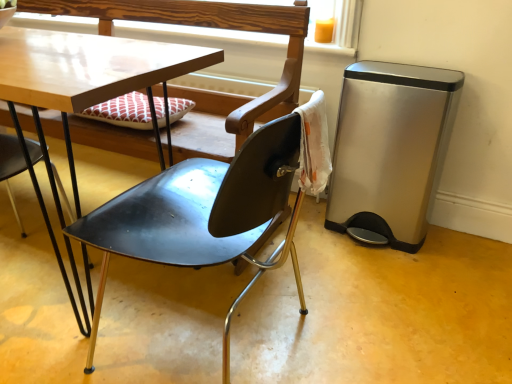
Question: Is the surface of black metal chair at lower left, the second chair when ordered from right to left, in direct contact with matte black chair at center, arranged as the first chair when viewed from the right?

Choices:
 (A) no
 (B) yes

Answer: (A)

Question: Does black metal chair at lower left, which appears as the 1th chair when viewed from the left, turn towards matte black chair at center, which is counted as the 2th chair, starting from the left?

Choices:
 (A) yes
 (B) no

Answer: (A)

Question: Is black metal chair at lower left, which appears as the 1th chair when viewed from the left, to the left of matte black chair at center, arranged as the first chair when viewed from the right, from the viewer's perspective?

Choices:
 (A) yes
 (B) no

Answer: (A)

Question: From the image's perspective, is black metal chair at lower left, the second chair when ordered from right to left, beneath matte black chair at center, which is counted as the 2th chair, starting from the left?

Choices:
 (A) no
 (B) yes

Answer: (B)

Question: Are black metal chair at lower left, the second chair when ordered from right to left, and matte black chair at center, arranged as the first chair when viewed from the right, far apart?

Choices:
 (A) yes
 (B) no

Answer: (B)

Question: Is black metal chair at lower left, the second chair when ordered from right to left, thinner than matte black chair at center, which is counted as the 2th chair, starting from the left?

Choices:
 (A) yes
 (B) no

Answer: (A)

Question: Can you confirm if satin silver trash can at right is positioned to the right of black metal chair at lower left, which appears as the 1th chair when viewed from the left?

Choices:
 (A) yes
 (B) no

Answer: (A)

Question: Is satin silver trash can at right beside black metal chair at lower left, the second chair when ordered from right to left?

Choices:
 (A) no
 (B) yes

Answer: (A)

Question: From the image's perspective, is satin silver trash can at right on black metal chair at lower left, the second chair when ordered from right to left?

Choices:
 (A) yes
 (B) no

Answer: (A)

Question: Is satin silver trash can at right wider than black metal chair at lower left, the second chair when ordered from right to left?

Choices:
 (A) yes
 (B) no

Answer: (B)

Question: Is satin silver trash can at right not close to black metal chair at lower left, the second chair when ordered from right to left?

Choices:
 (A) no
 (B) yes

Answer: (B)

Question: From the image's perspective, is satin silver trash can at right located beneath black metal chair at lower left, the second chair when ordered from right to left?

Choices:
 (A) yes
 (B) no

Answer: (B)

Question: Is wooden at upper center facing towards matte black chair at center, which is counted as the 2th chair, starting from the left?

Choices:
 (A) yes
 (B) no

Answer: (A)